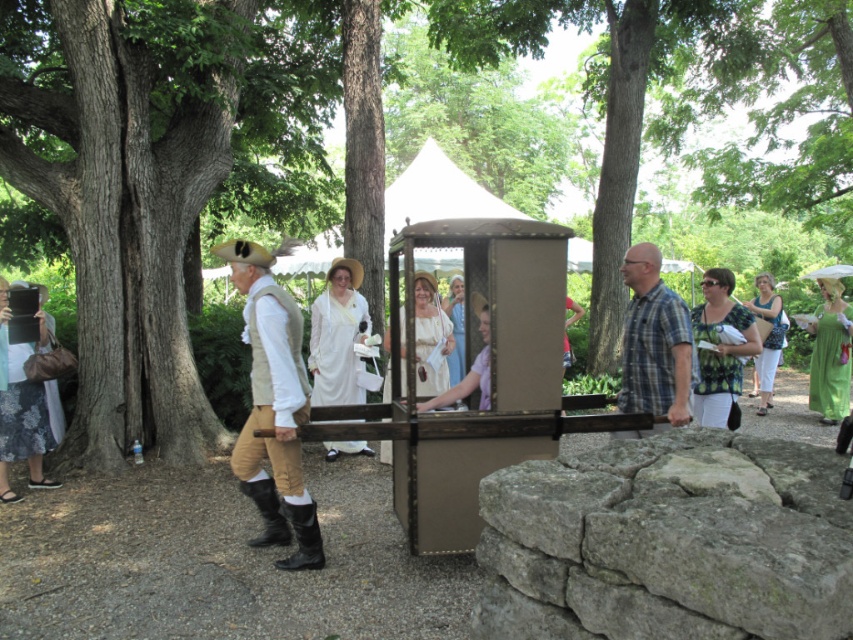
Can you confirm if brown rough tree trunk at center is positioned to the right of green cotton dress at right?

No, brown rough tree trunk at center is not to the right of green cotton dress at right.

Can you confirm if brown rough tree trunk at center is smaller than green cotton dress at right?

No.

Image resolution: width=853 pixels, height=640 pixels. What are the coordinates of `brown rough tree trunk at center` in the screenshot? It's located at (148, 173).

Image resolution: width=853 pixels, height=640 pixels. What are the coordinates of `green satin dress at right` in the screenshot? It's located at (830, 353).

Between point (828, 332) and point (759, 365), which one is positioned behind?

Point (759, 365)

Identify the location of green satin dress at right. (830, 353).

Who is more distant from viewer, (254, 442) or (724, 372)?

The point (724, 372) is behind.

Between light brown leather pants at center and green printed blouse at center, which one is positioned lower?

light brown leather pants at center

Is point (256, 401) closer to viewer compared to point (709, 346)?

Yes, point (256, 401) is closer to viewer.

At what (x,y) coordinates should I click in order to perform the action: click on light brown leather pants at center. Please return your answer as a coordinate pair (x, y). This screenshot has height=640, width=853. Looking at the image, I should click on (273, 404).